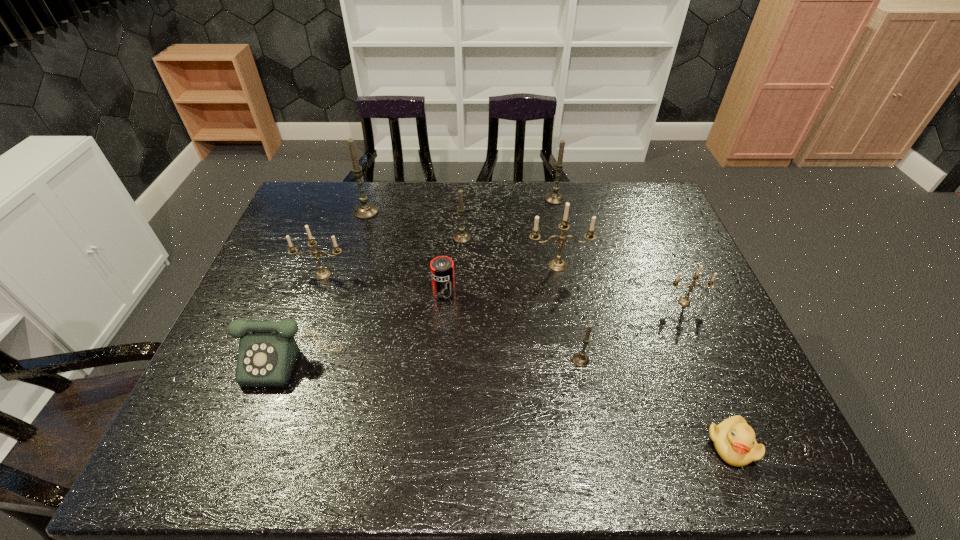
Where is `the tallest object`? The width and height of the screenshot is (960, 540). the tallest object is located at coordinates (366, 210).

Locate an element on the screen. The width and height of the screenshot is (960, 540). the tallest candle is located at coordinates (366, 210).

Locate an element on the screen. The height and width of the screenshot is (540, 960). the second biggest gray candle is located at coordinates [x=555, y=198].

Find the location of a particular element. the biggest metallic candle is located at coordinates (557, 265).

This screenshot has height=540, width=960. I want to click on the fifth candle from right to left, so click(x=461, y=237).

What are the coordinates of `the second nearest gray candle` in the screenshot? It's located at (461, 237).

Locate an element on the screen. The height and width of the screenshot is (540, 960). the leftmost metallic candle is located at coordinates (322, 274).

Locate an element on the screen. the nearest gray candle is located at coordinates (580, 359).

Locate an element on the screen. the nearest candle is located at coordinates (580, 359).

I want to click on the second nearest candle, so click(685, 301).